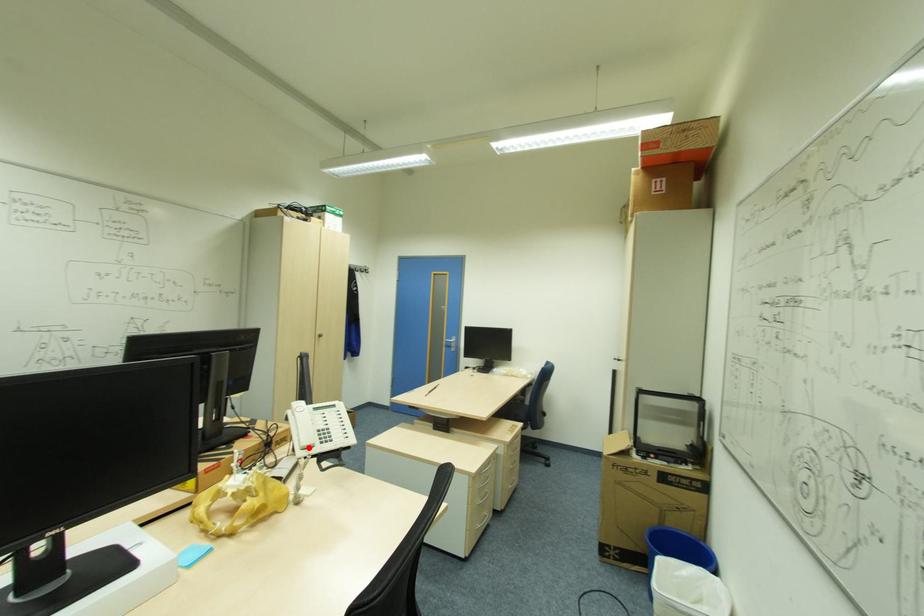
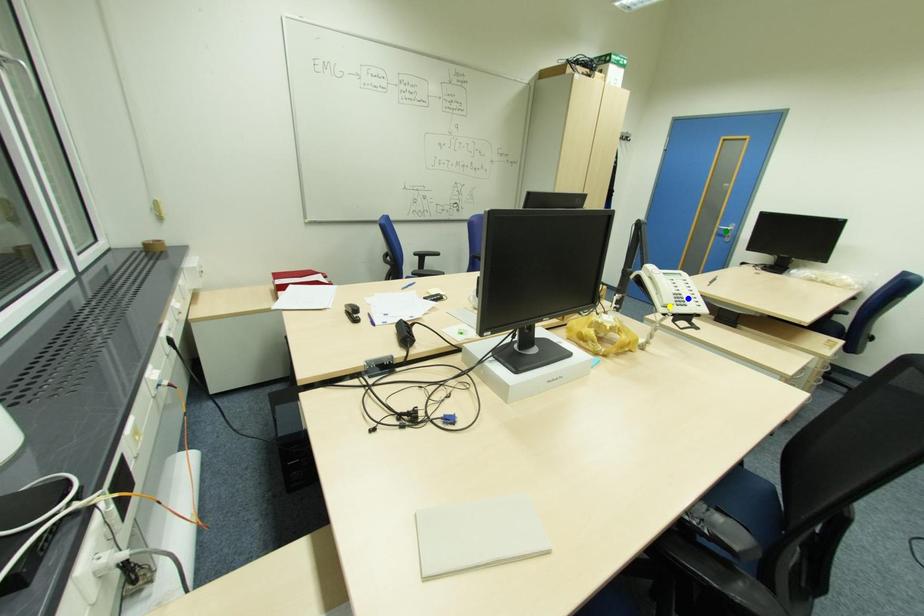
Question: I am providing you with two images of the same scene from different viewpoints. A red point is marked on the first image. You are given multiple points on the second image. Can you choose the point in image 2 that corresponds to the point in image 1?

Choices:
 (A) green point
 (B) blue point
 (C) yellow point

Answer: (C)